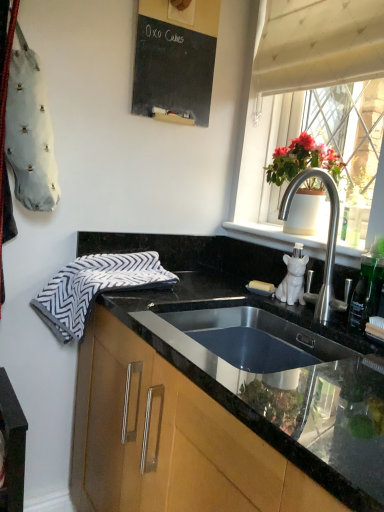
Question: Considering the relative sizes of black chalkboard at upper center and wooden cabinet at lower center in the image provided, is black chalkboard at upper center smaller than wooden cabinet at lower center?

Choices:
 (A) no
 (B) yes

Answer: (B)

Question: Is black chalkboard at upper center not inside wooden cabinet at lower center?

Choices:
 (A) yes
 (B) no

Answer: (A)

Question: From a real-world perspective, is black chalkboard at upper center located beneath wooden cabinet at lower center?

Choices:
 (A) no
 (B) yes

Answer: (A)

Question: Does black chalkboard at upper center lie in front of wooden cabinet at lower center?

Choices:
 (A) no
 (B) yes

Answer: (A)

Question: Is black chalkboard at upper center oriented away from wooden cabinet at lower center?

Choices:
 (A) no
 (B) yes

Answer: (A)

Question: From the image's perspective, is translucent glass window at upper right above or below white textured curtain at upper right?

Choices:
 (A) above
 (B) below

Answer: (B)

Question: Based on their sizes in the image, would you say translucent glass window at upper right is bigger or smaller than white textured curtain at upper right?

Choices:
 (A) small
 (B) big

Answer: (B)

Question: From their relative heights in the image, would you say translucent glass window at upper right is taller or shorter than white textured curtain at upper right?

Choices:
 (A) tall
 (B) short

Answer: (A)

Question: In the image, is translucent glass window at upper right positioned in front of or behind white textured curtain at upper right?

Choices:
 (A) front
 (B) behind

Answer: (A)

Question: From a real-world perspective, is matte white pot at right physically located above or below translucent glass window at upper right?

Choices:
 (A) above
 (B) below

Answer: (B)

Question: Considering their positions, is matte white pot at right located in front of or behind translucent glass window at upper right?

Choices:
 (A) behind
 (B) front

Answer: (A)

Question: Considering the positions of point [x=281, y=157] and point [x=327, y=73], is point [x=281, y=157] closer or farther from the camera than point [x=327, y=73]?

Choices:
 (A) farther
 (B) closer

Answer: (A)

Question: Considering the positions of matte white pot at right and translucent glass window at upper right in the image, is matte white pot at right taller or shorter than translucent glass window at upper right?

Choices:
 (A) tall
 (B) short

Answer: (B)

Question: In the image, is white ceramic cat at right positioned in front of or behind matte white pot at right?

Choices:
 (A) behind
 (B) front

Answer: (B)

Question: From a real-world perspective, is white ceramic cat at right physically located above or below matte white pot at right?

Choices:
 (A) above
 (B) below

Answer: (B)